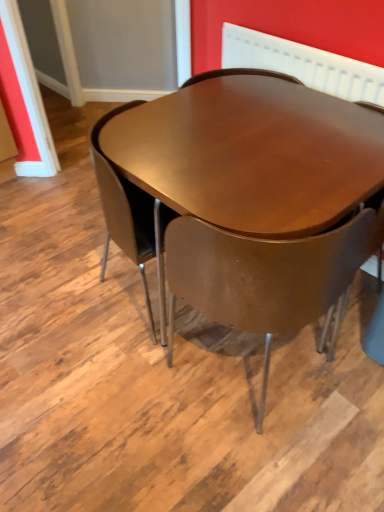
Question: Is matte brown chair at center wider or thinner than shiny brown table at center?

Choices:
 (A) wide
 (B) thin

Answer: (B)

Question: Considering the positions of point (220, 308) and point (162, 249), is point (220, 308) closer or farther from the camera than point (162, 249)?

Choices:
 (A) closer
 (B) farther

Answer: (A)

Question: Estimate the real-world distances between objects in this image. Which object is farther from the white textured radiator at upper center?

Choices:
 (A) matte brown chair at center
 (B) shiny brown table at center

Answer: (A)

Question: Which object is the farthest from the shiny brown table at center?

Choices:
 (A) white textured radiator at upper center
 (B) matte brown chair at center

Answer: (A)